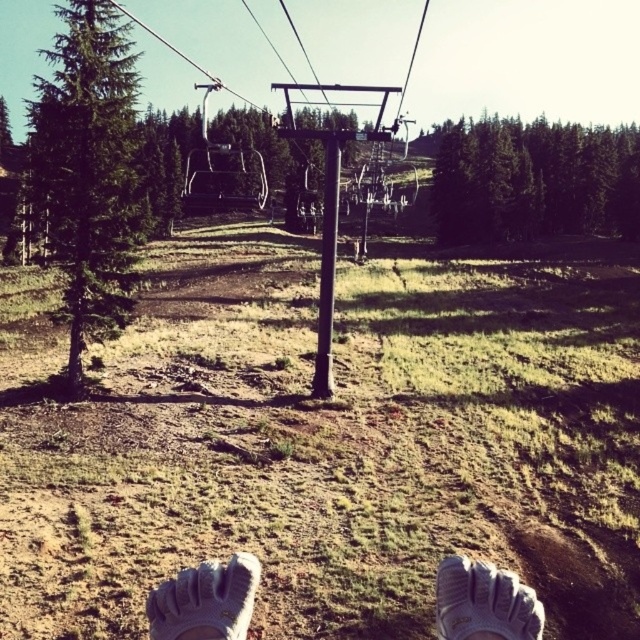
In the scene shown: You are a photographer trying to capture a closeup of the white textured shoes at lower center. If your camera has a minimum focusing distance of 4 feet, will you be able to take the photo without moving the shoes?

The white textured shoes at lower center is 4.61 feet away from camera. Since the minimum focusing distance is 4 feet, the camera can focus on the shoes as they are beyond the minimum distance required.

You are a photographer trying to capture both the white textured shoe at lower center and the white mesh shoe at lower center in a single shot. Which shoe should you adjust your camera angle to focus on first if you want to ensure both are fully visible in the frame?

You should focus on the white textured shoe at lower center first because it is positioned to the left of the white mesh shoe at lower center, so adjusting the angle to include its leftmost edge will naturally include the right side of the white mesh shoe at lower center as well.

You are standing on a chairlift and want to check if your white textured shoes at lower center are positioned directly below the chairlift seat. Based on the coordinates provided, can you confirm their position?

The white textured shoes at lower center are located at coordinates point (205,600), which would place them directly below the chairlift seat if that is the reference point.